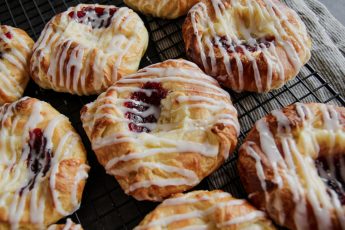
The height and width of the screenshot is (230, 345). I want to click on dish towel, so click(328, 44).